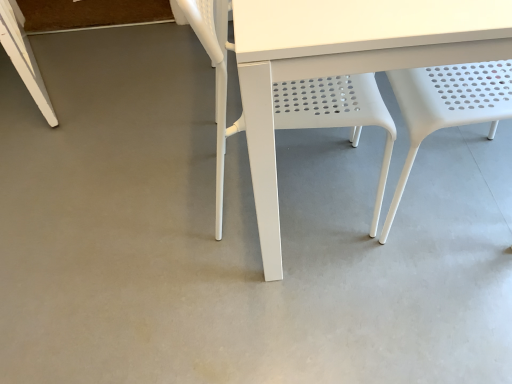
Find the location of a particular element. The width and height of the screenshot is (512, 384). free point to the left of white plastic chair at center, which appears as the 2th chair when viewed from the right is located at coordinates (160, 208).